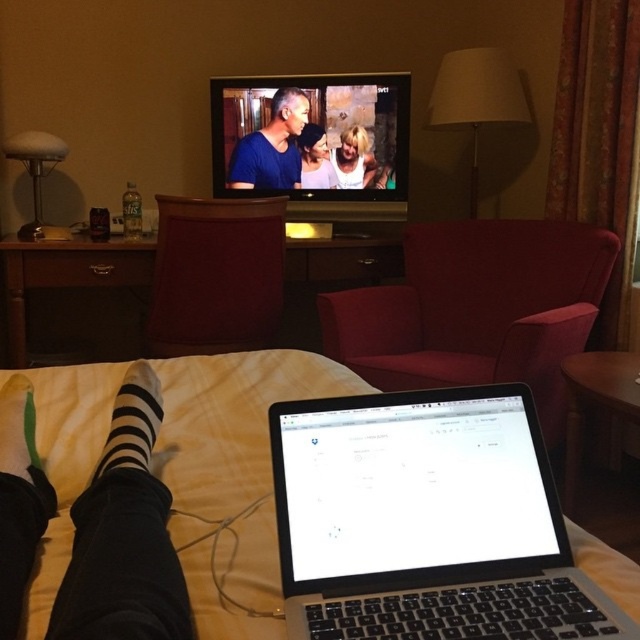
Question: Can you confirm if silver/black laptop at lower center is wider than green fabric sock at lower left?

Choices:
 (A) no
 (B) yes

Answer: (B)

Question: Which object is positioned closest to the matte wood armchair at center?

Choices:
 (A) green fabric sock at lower left
 (B) white matte tank top at center

Answer: (B)

Question: Is matte red armchair at center behind white matte tank top at center?

Choices:
 (A) yes
 (B) no

Answer: (B)

Question: Does white striped socks at lower left have a larger size compared to black striped sock at lower left?

Choices:
 (A) no
 (B) yes

Answer: (B)

Question: Which of the following is the closest to the observer?

Choices:
 (A) white striped socks at lower left
 (B) black striped sock at lower left

Answer: (A)

Question: Which point appears farthest from the camera in this image?

Choices:
 (A) (490, 380)
 (B) (4, 385)
 (C) (138, 362)
 (D) (225, 266)

Answer: (D)